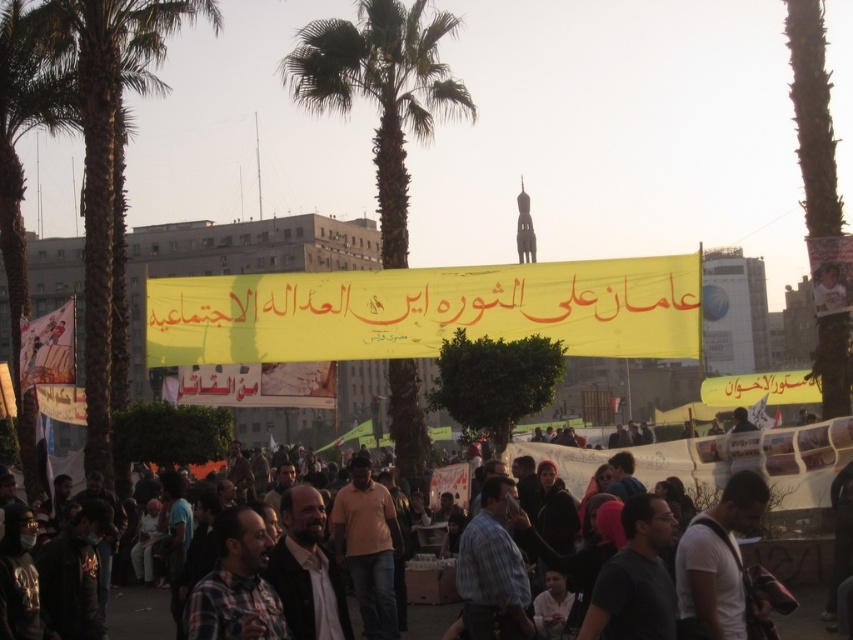
Is point (619, 294) closer to viewer compared to point (399, 364)?

Yes.

Which is more to the right, yellow/yellowish paper at center or green leafy palm tree at center?

Positioned to the right is yellow/yellowish paper at center.

Is point (498, 307) positioned after point (403, 364)?

No, it is not.

Where is `yellow/yellowish paper at center`? This screenshot has height=640, width=853. yellow/yellowish paper at center is located at coordinates (427, 310).

Does yellow/yellowish paper at center come behind plaid shirt at center?

Yes, it is behind plaid shirt at center.

Is point (200, 289) farther from camera compared to point (505, 570)?

Yes, it is behind point (505, 570).

Which is in front, point (653, 300) or point (457, 577)?

Positioned in front is point (457, 577).

Where is `yellow/yellowish paper at center`? yellow/yellowish paper at center is located at coordinates (427, 310).

Where is `yellow/yellowish paper at center`? yellow/yellowish paper at center is located at coordinates (427, 310).

At what (x,y) coordinates should I click in order to perform the action: click on yellow/yellowish paper at center. Please return your answer as a coordinate pair (x, y). Looking at the image, I should click on (427, 310).